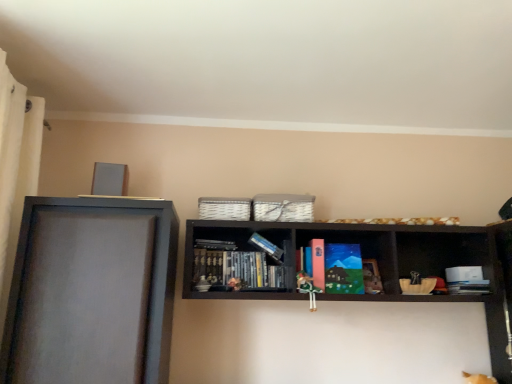
Question: Can you confirm if wooden bookshelf at center, the 1th shelf positioned from the right, is thinner than matte gray frame at left, positioned as the 1th shelf in left-to-right order?

Choices:
 (A) no
 (B) yes

Answer: (B)

Question: From the image's perspective, is wooden bookshelf at center, the 1th shelf positioned from the right, above matte gray frame at left, positioned as the 1th shelf in left-to-right order?

Choices:
 (A) yes
 (B) no

Answer: (A)

Question: Considering the relative sizes of wooden bookshelf at center, which is the second shelf from left to right, and matte gray frame at left, positioned as the 1th shelf in left-to-right order, in the image provided, is wooden bookshelf at center, which is the second shelf from left to right, wider than matte gray frame at left, positioned as the 1th shelf in left-to-right order,?

Choices:
 (A) no
 (B) yes

Answer: (A)

Question: Is wooden bookshelf at center, the 1th shelf positioned from the right, to the left of matte gray frame at left, positioned as the 1th shelf in left-to-right order, from the viewer's perspective?

Choices:
 (A) yes
 (B) no

Answer: (B)

Question: Is wooden bookshelf at center, which is the second shelf from left to right, next to matte gray frame at left, the 2th shelf positioned from the right, and touching it?

Choices:
 (A) no
 (B) yes

Answer: (A)

Question: From a real-world perspective, is wooden bookshelf at center, which is the second shelf from left to right, located beneath matte gray frame at left, positioned as the 1th shelf in left-to-right order?

Choices:
 (A) no
 (B) yes

Answer: (A)

Question: Is matte paperback book at center at the left side of black matte bookshelf at center, the second book positioned from the right?

Choices:
 (A) no
 (B) yes

Answer: (A)

Question: Are matte paperback book at center and black matte bookshelf at center, the second book positioned from the right, making contact?

Choices:
 (A) yes
 (B) no

Answer: (B)

Question: Is matte paperback book at center wider than black matte bookshelf at center, the first book when ordered from top to bottom?

Choices:
 (A) no
 (B) yes

Answer: (A)

Question: Is matte paperback book at center closer to camera compared to black matte bookshelf at center, which is the second book in bottom-to-top order?

Choices:
 (A) no
 (B) yes

Answer: (B)

Question: Could you tell me if matte paperback book at center is turned towards black matte bookshelf at center, the first book when ordered from top to bottom?

Choices:
 (A) no
 (B) yes

Answer: (A)

Question: Is matte paperback book at center behind black matte bookshelf at center, which is the second book in bottom-to-top order?

Choices:
 (A) yes
 (B) no

Answer: (B)

Question: Are wooden bookshelf at center, the 1th shelf positioned from the right, and green fabric doll at center located far from each other?

Choices:
 (A) no
 (B) yes

Answer: (A)